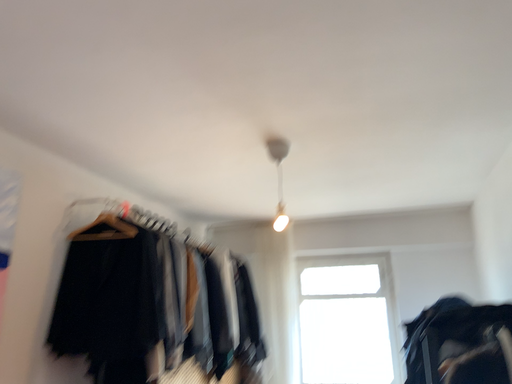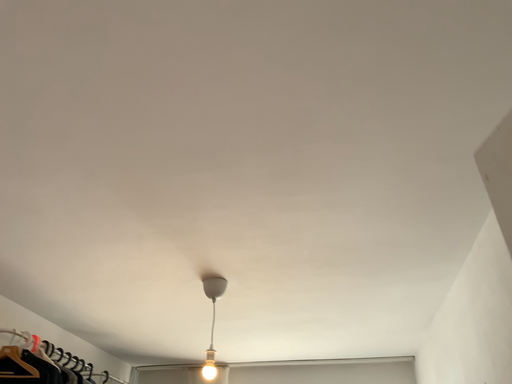
Question: How did the camera likely rotate when shooting the video?

Choices:
 (A) rotated right
 (B) rotated left

Answer: (A)